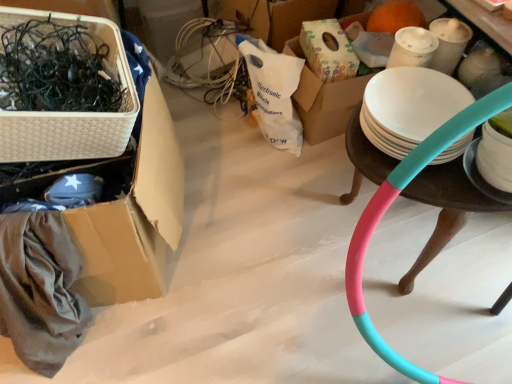
Identify the location of free space to the left of teal matte hula hoop at right. The width and height of the screenshot is (512, 384). (257, 222).